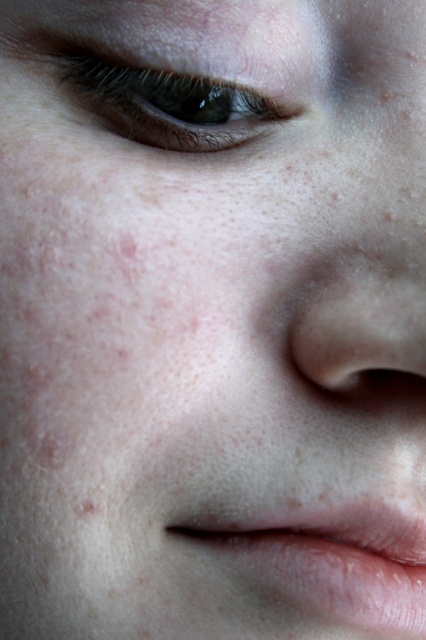
You are an artist trying to sketch this face. To accurately place the pink smooth lips at lower center, what are their coordinates?

The pink smooth lips at lower center are located at coordinates 0.873 on the x axis and 0.763 on the y axis.

You are a makeup artist preparing to apply lipstick. You have a small applicator that can only cover areas up to the size of the brown matte eye at upper left. Can you use this applicator to fully cover the pink smooth lips at lower center?

The pink smooth lips at lower center are larger than the brown matte eye at upper left. Since the applicator can only cover the size of the brown matte eye at upper left, it may not be sufficient to fully cover the larger pink smooth lips at lower center in a single application.

You are a photographer trying to capture a closeup of a person. You want to focus on the point at point (x=255, y=573). If your camera is currently 12.76 inches away from this point, do you need to move closer or farther to ensure the subject is in focus?

The point (x=255, y=573) is 12.76 inches away from the camera. To ensure the subject is in focus, you need to adjust the focus distance to match the camera to this point. Since the camera is already positioned at the correct distance of 12.76 inches from the point, no adjustment is needed. The camera is already at the right distance to focus on the point (x=255, y=573).